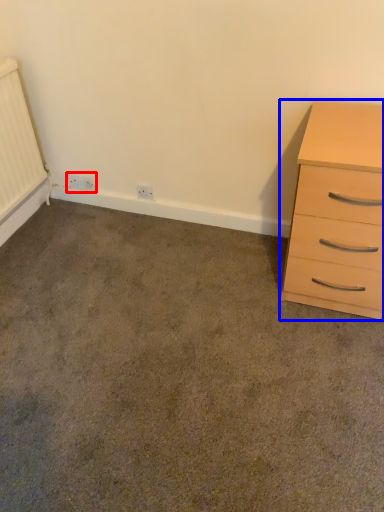
Question: Which point is closer to the camera, electric outlet (highlighted by a red box) or chest of drawers (highlighted by a blue box)?

Choices:
 (A) electric outlet
 (B) chest of drawers

Answer: (B)